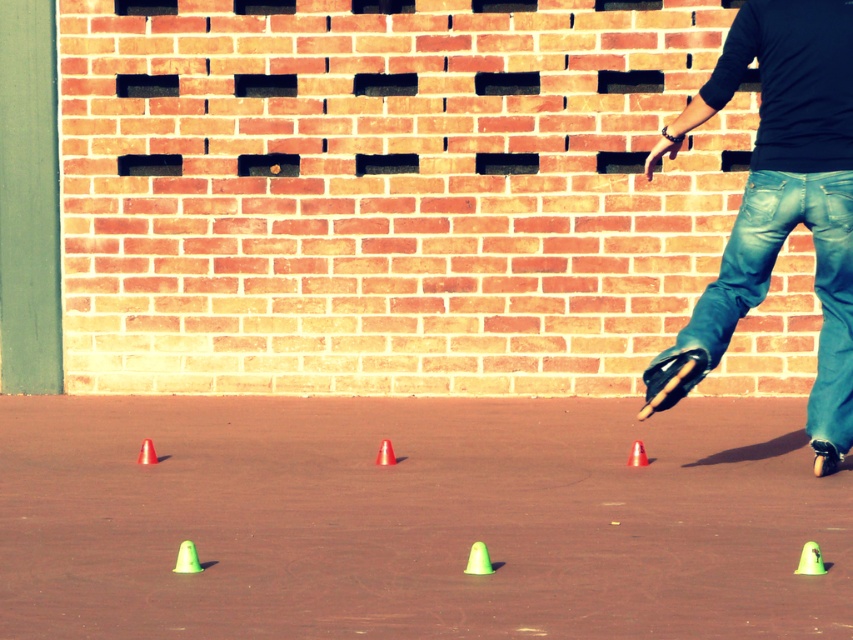
Question: Does blue denim jeans at right have a larger size compared to green matte traffic cone at lower right?

Choices:
 (A) yes
 (B) no

Answer: (A)

Question: Is blue denim jeans at right positioned behind orange plastic cone at lower left?

Choices:
 (A) no
 (B) yes

Answer: (A)

Question: Observing the image, what is the correct spatial positioning of green plastic cones at center in reference to orange plastic cone at lower left?

Choices:
 (A) above
 (B) below

Answer: (B)

Question: Which point is farther from the camera taking this photo?

Choices:
 (A) (489, 572)
 (B) (637, 452)
 (C) (149, 456)
 (D) (805, 570)

Answer: (C)

Question: Which object appears farthest from the camera in this image?

Choices:
 (A) blue denim jeans at right
 (B) green matte traffic cone at lower left

Answer: (A)

Question: Which point is closer to the camera?

Choices:
 (A) green plastic cones at center
 (B) orange matte traffic cone at center
 (C) matte orange cone at center
 (D) green matte traffic cone at lower left

Answer: (D)